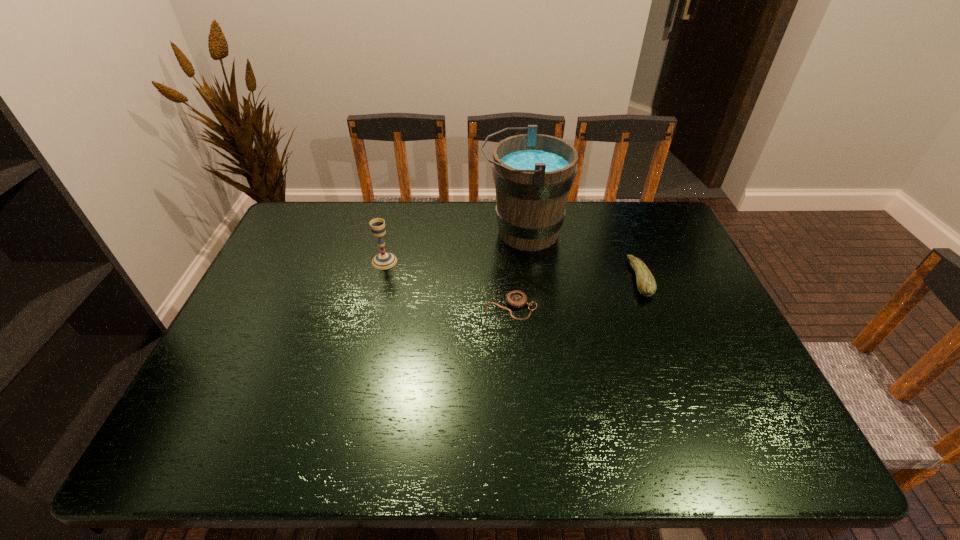
Locate an element on the screen. free region at the near right corner is located at coordinates (786, 457).

This screenshot has width=960, height=540. I want to click on free space between the leftmost object and the wine bucket, so click(454, 247).

The width and height of the screenshot is (960, 540). What are the coordinates of `vacant region between the third shortest object and the wine bucket` in the screenshot? It's located at (454, 247).

Where is `vacant point located between the leftmost object and the wine bucket`? vacant point located between the leftmost object and the wine bucket is located at coordinates (454, 247).

You are a GUI agent. You are given a task and a screenshot of the screen. Output one action in this format:
    pyautogui.click(x=<x>, y=<y>)
    Task: Click on the free point between the rightmost object and the shortest object
    The height and width of the screenshot is (540, 960).
    Given the screenshot: What is the action you would take?
    pyautogui.click(x=575, y=293)

Where is `empty location between the second shortest object and the leftmost object`? The image size is (960, 540). empty location between the second shortest object and the leftmost object is located at coordinates (512, 270).

Image resolution: width=960 pixels, height=540 pixels. What are the coordinates of `vacant space that's between the second shortest object and the tallest object` in the screenshot? It's located at (582, 255).

Locate an element on the screen. The image size is (960, 540). vacant space in between the zucchini and the chalice is located at coordinates (512, 270).

At what (x,y) coordinates should I click in order to perform the action: click on empty space that is in between the third tallest object and the second tallest object. Please return your answer as a coordinate pair (x, y). This screenshot has width=960, height=540. Looking at the image, I should click on (512, 270).

Find the location of a particular element. vacant space in between the wine bucket and the third shortest object is located at coordinates (454, 247).